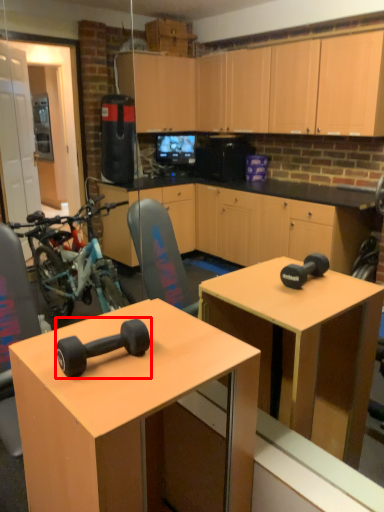
Question: From the image's perspective, where is dumbbell (annotated by the red box) located relative to desk?

Choices:
 (A) below
 (B) above

Answer: (B)